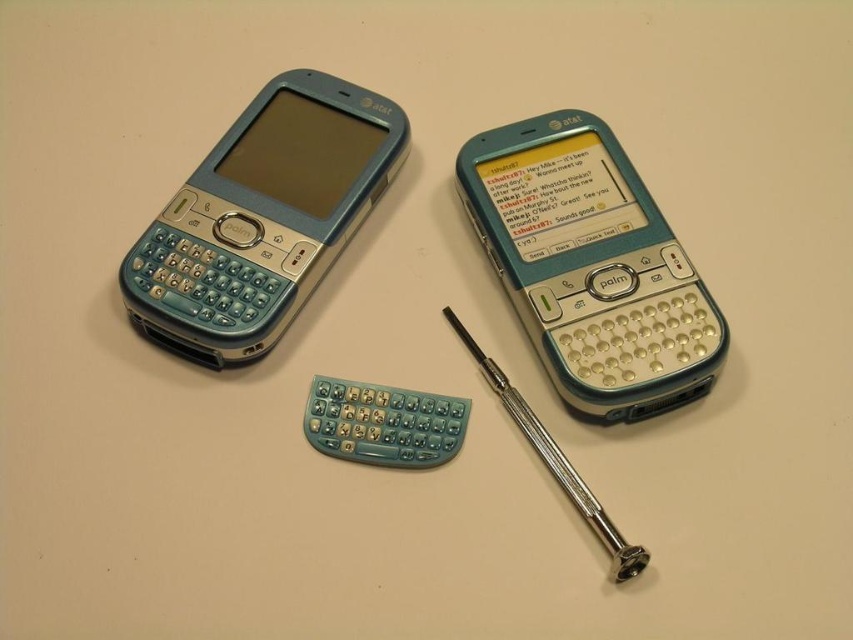
Question: Is teal plastic smartphone at center to the right of teal plastic keyboard at left from the viewer's perspective?

Choices:
 (A) no
 (B) yes

Answer: (B)

Question: Does teal plastic smartphone at center have a lesser width compared to teal plastic keyboard at left?

Choices:
 (A) yes
 (B) no

Answer: (A)

Question: Which object is farther from the camera taking this photo?

Choices:
 (A) teal plastic keyboard at left
 (B) teal plastic smartphone at center

Answer: (A)

Question: Does teal plastic smartphone at center have a greater width compared to teal plastic keyboard at left?

Choices:
 (A) yes
 (B) no

Answer: (B)

Question: Which point is closer to the camera taking this photo?

Choices:
 (A) (308, 150)
 (B) (694, 307)

Answer: (B)

Question: Which object is closer to the camera taking this photo?

Choices:
 (A) teal plastic smartphone at center
 (B) teal plastic keyboard at left

Answer: (A)